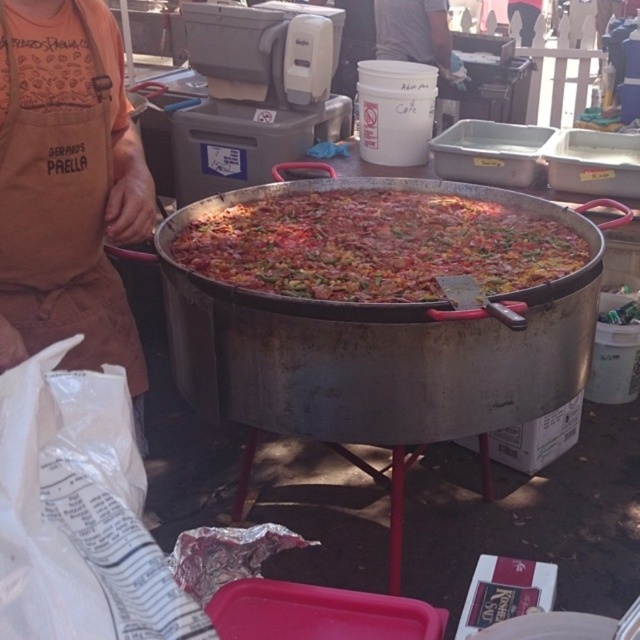
Question: Is brown apron at left below multicolored rice at center?

Choices:
 (A) no
 (B) yes

Answer: (B)

Question: Is brown apron at left wider than multicolored rice at center?

Choices:
 (A) yes
 (B) no

Answer: (B)

Question: Which of the following is the closest to the observer?

Choices:
 (A) coord(243,288)
 (B) coord(38,218)

Answer: (B)

Question: Is brown apron at left closer to camera compared to multicolored rice at center?

Choices:
 (A) no
 (B) yes

Answer: (B)

Question: Which object appears farthest from the camera in this image?

Choices:
 (A) multicolored rice at center
 (B) brown apron at left

Answer: (A)

Question: Among these objects, which one is farthest from the camera?

Choices:
 (A) multicolored rice at center
 (B) brown apron at left

Answer: (A)